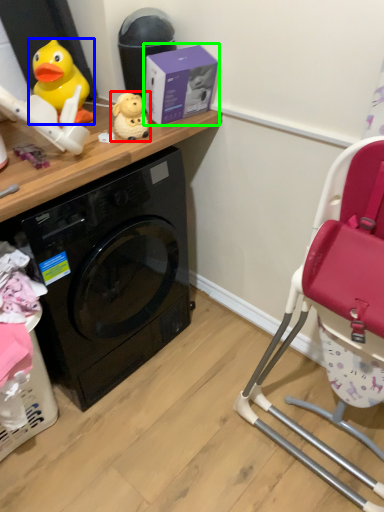
Question: Based on their relative distances, which object is farther from toy (highlighted by a red box)? Choose from toy (highlighted by a blue box) and box (highlighted by a green box).

Choices:
 (A) toy
 (B) box

Answer: (A)